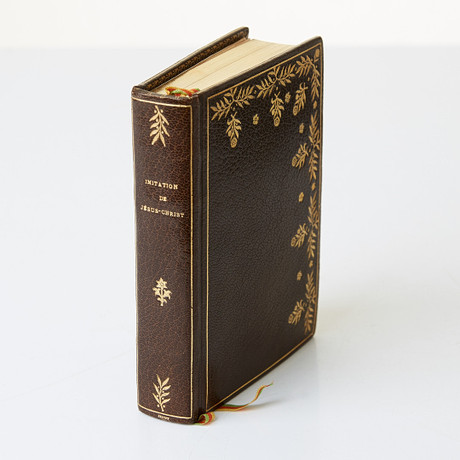
Identify the location of leather bound book. (201, 243).